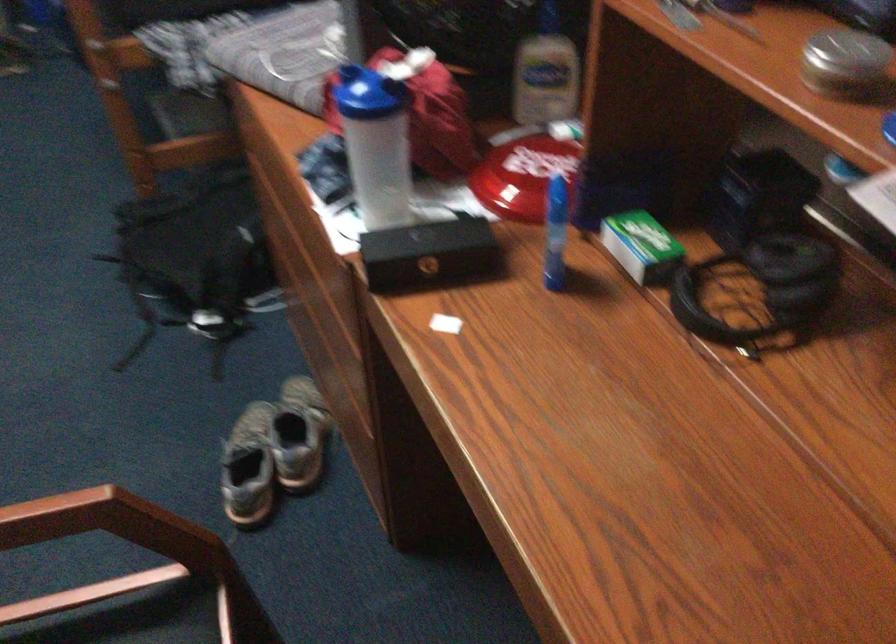
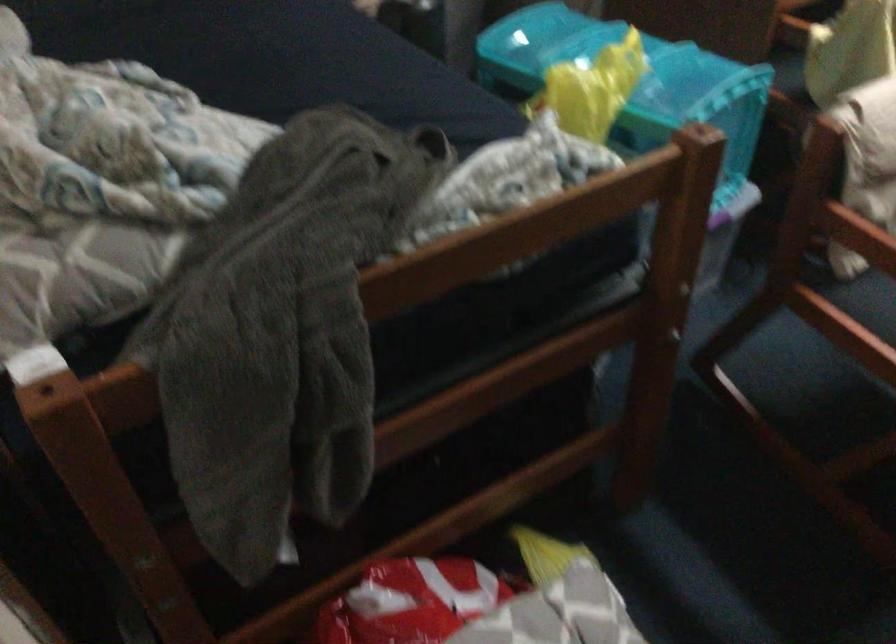
First-person continuous shooting, in which direction is the camera rotating?

The camera rotated toward left-down.